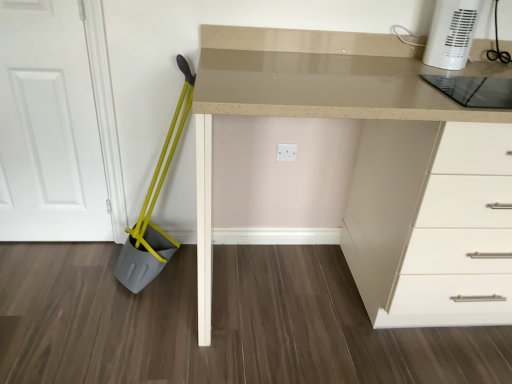
Image resolution: width=512 pixels, height=384 pixels. What do you see at coordinates (452, 33) in the screenshot?
I see `white plastic heater at upper right` at bounding box center [452, 33].

What do you see at coordinates (49, 126) in the screenshot?
I see `white matte door at left` at bounding box center [49, 126].

Where is `transparent glass cutting board at upper right`? This screenshot has height=384, width=512. transparent glass cutting board at upper right is located at coordinates [474, 90].

Find the location of `white plastic heater at upper right`. white plastic heater at upper right is located at coordinates [x=452, y=33].

Is yellow plastic shovel at left far from white plastic heater at upper right?

Absolutely, yellow plastic shovel at left is distant from white plastic heater at upper right.

Is point (158, 241) positioned after point (435, 22)?

Yes, it is.

Is white matte door at left in front of or behind white plastic heater at upper right in the image?

white matte door at left is positioned farther from the viewer than white plastic heater at upper right.

Considering the positions of objects white matte door at left and white plastic heater at upper right in the image provided, who is more to the left, white matte door at left or white plastic heater at upper right?

Positioned to the left is white matte door at left.

From the image's perspective, is white matte door at left above or below white plastic heater at upper right?

From the image's perspective, white matte door at left appears below white plastic heater at upper right.

From a real-world perspective, is transparent glass cutting board at upper right beneath matte beige desk at center?

No.

Is transparent glass cutting board at upper right oriented towards matte beige desk at center?

Yes, transparent glass cutting board at upper right is turned towards matte beige desk at center.

Can you confirm if transparent glass cutting board at upper right is shorter than matte beige desk at center?

Yes.

Does white matte door at left have a greater height compared to matte beige desk at center?

Yes, white matte door at left is taller than matte beige desk at center.

Where is `computer desk located on the right of white matte door at left`? The image size is (512, 384). computer desk located on the right of white matte door at left is located at coordinates (302, 102).

Is matte beige desk at center completely or partially inside white matte door at left?

Definitely not — matte beige desk at center is not inside white matte door at left.

Are yellow plastic shovel at left and matte beige desk at center beside each other?

No.

From the image's perspective, is yellow plastic shovel at left above matte beige desk at center?

Yes, from the image's perspective, yellow plastic shovel at left is above matte beige desk at center.

Does yellow plastic shovel at left come behind matte beige desk at center?

Yes, it is.

Which of these two, yellow plastic shovel at left or matte beige desk at center, is bigger?

Bigger between the two is matte beige desk at center.

From a real-world perspective, which is physically above, matte beige desk at center or white matte door at left?

white matte door at left, from a real-world perspective.

This screenshot has width=512, height=384. Identify the location of computer desk that is under the white matte door at left (from a real-world perspective). (302, 102).

In the scene shown: Between matte beige desk at center and white matte door at left, which one appears on the right side from the viewer's perspective?

matte beige desk at center.

In terms of height, does matte beige desk at center look taller or shorter compared to white matte door at left?

matte beige desk at center is shorter than white matte door at left.

Is yellow plastic shovel at left not near white matte door at left?

yellow plastic shovel at left is actually quite close to white matte door at left.

Who is taller, yellow plastic shovel at left or white matte door at left?

white matte door at left.

Does yellow plastic shovel at left have a larger size compared to white matte door at left?

Correct, yellow plastic shovel at left is larger in size than white matte door at left.

Can you confirm if yellow plastic shovel at left is thinner than white matte door at left?

Incorrect, the width of yellow plastic shovel at left is not less than that of white matte door at left.

Where is `shovel located below the white plastic heater at upper right (from the image's perspective)`? This screenshot has height=384, width=512. shovel located below the white plastic heater at upper right (from the image's perspective) is located at coordinates (153, 207).

This screenshot has width=512, height=384. Identify the location of home appliance above the white matte door at left (from a real-world perspective). (452, 33).

From the picture: Which object lies further to the anchor point white matte door at left, yellow plastic shovel at left or transparent glass cutting board at upper right?

The object further to white matte door at left is transparent glass cutting board at upper right.

Estimate the real-world distances between objects in this image. Which object is further from yellow plastic shovel at left, white plastic heater at upper right or white matte door at left?

white plastic heater at upper right.

Estimate the real-world distances between objects in this image. Which object is closer to white plastic heater at upper right, transparent glass cutting board at upper right or white matte door at left?

transparent glass cutting board at upper right is closer to white plastic heater at upper right.

Looking at the image, which one is located further to white matte door at left, yellow plastic shovel at left or white plastic heater at upper right?

white plastic heater at upper right is positioned further to the anchor white matte door at left.

Considering their positions, is white matte door at left positioned further to transparent glass cutting board at upper right than white plastic heater at upper right?

white matte door at left lies further to transparent glass cutting board at upper right than the other object.

Looking at the image, which one is located further to yellow plastic shovel at left, transparent glass cutting board at upper right or white plastic heater at upper right?

transparent glass cutting board at upper right is positioned further to the anchor yellow plastic shovel at left.

When comparing their distances from matte beige desk at center, does yellow plastic shovel at left or white matte door at left seem closer?

yellow plastic shovel at left is positioned closer to the anchor matte beige desk at center.

Based on the photo, based on their spatial positions, is yellow plastic shovel at left or matte beige desk at center closer to white plastic heater at upper right?

The object closer to white plastic heater at upper right is matte beige desk at center.

You are a GUI agent. You are given a task and a screenshot of the screen. Output one action in this format:
    pyautogui.click(x=<x>, y=<y>)
    Task: Click on the computer desk between white matte door at left and transparent glass cutting board at upper right from left to right
    This screenshot has width=512, height=384.
    Given the screenshot: What is the action you would take?
    pyautogui.click(x=302, y=102)

At what (x,y) coordinates should I click in order to perform the action: click on kitchen appliance between white plastic heater at upper right and matte beige desk at center from top to bottom. Please return your answer as a coordinate pair (x, y). The image size is (512, 384). Looking at the image, I should click on (474, 90).

Identify the location of computer desk between white matte door at left and white plastic heater at upper right in the horizontal direction. This screenshot has height=384, width=512. (302, 102).

The height and width of the screenshot is (384, 512). I want to click on home appliance between yellow plastic shovel at left and transparent glass cutting board at upper right, so click(x=452, y=33).